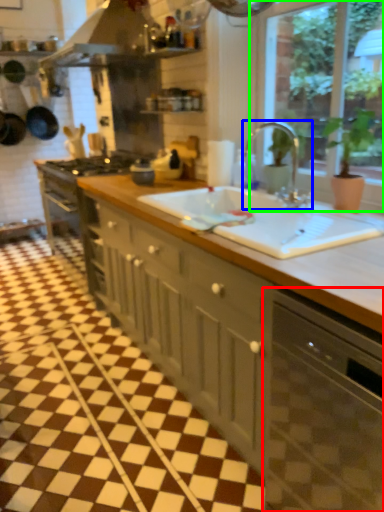
Question: Considering the real-world distances, which object is closest to dish washer (highlighted by a red box)? tap (highlighted by a blue box) or window (highlighted by a green box).

Choices:
 (A) tap
 (B) window

Answer: (A)